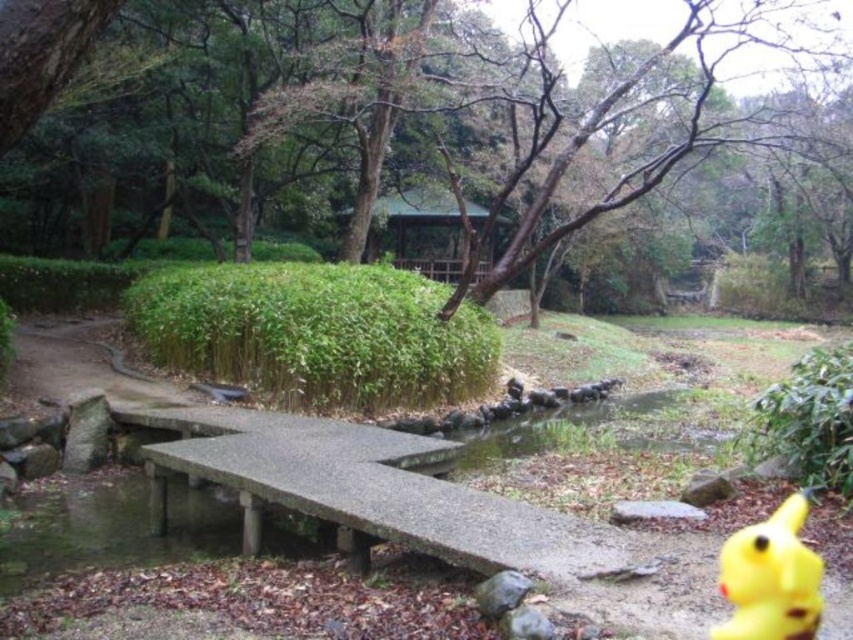
Is gray concrete picnic table at center smaller than green leafy tree at center?

Yes.

Can you confirm if gray concrete picnic table at center is positioned to the left of green leafy tree at center?

Yes, gray concrete picnic table at center is to the left of green leafy tree at center.

Who is more forward, (210,442) or (68,8)?

Positioned in front is point (68,8).

I want to click on gray concrete picnic table at center, so click(x=370, y=490).

Is green leafy tree at center bigger than yellow rubber duck at lower right?

Indeed, green leafy tree at center has a larger size compared to yellow rubber duck at lower right.

Is green leafy tree at center below yellow rubber duck at lower right?

Incorrect, green leafy tree at center is not positioned below yellow rubber duck at lower right.

Is point (61, 56) positioned before point (811, 605)?

Yes, point (61, 56) is in front of point (811, 605).

Image resolution: width=853 pixels, height=640 pixels. Find the location of `green leafy tree at center`. green leafy tree at center is located at coordinates (41, 54).

Consider the image. Does gray concrete picnic table at center have a greater height compared to yellow rubber duck at lower right?

Correct, gray concrete picnic table at center is much taller as yellow rubber duck at lower right.

Who is more distant from viewer, (x=288, y=490) or (x=799, y=586)?

Positioned behind is point (x=288, y=490).

Identify the location of gray concrete picnic table at center. (370, 490).